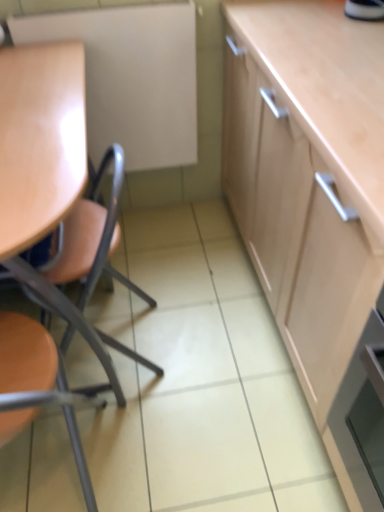
Question: In terms of height, does matte wood chair at left, acting as the first chair starting from the top, look taller or shorter compared to matte orange chair at left, which is the 2th chair from top to bottom?

Choices:
 (A) short
 (B) tall

Answer: (B)

Question: Is matte wood chair at left, positioned as the second chair in bottom-to-top order, inside the boundaries of matte orange chair at left, which is the 2th chair from top to bottom, or outside?

Choices:
 (A) outside
 (B) inside

Answer: (A)

Question: Based on their relative distances, which object is farther from the matte wood chair at left, positioned as the second chair in bottom-to-top order?

Choices:
 (A) matte white board at upper left
 (B) matte orange chair at left, arranged as the 1th chair when ordered from the bottom

Answer: (A)

Question: Estimate the real-world distances between objects in this image. Which object is farther from the matte white board at upper left?

Choices:
 (A) matte orange chair at left, which is the 2th chair from top to bottom
 (B) matte wood chair at left, positioned as the second chair in bottom-to-top order

Answer: (A)